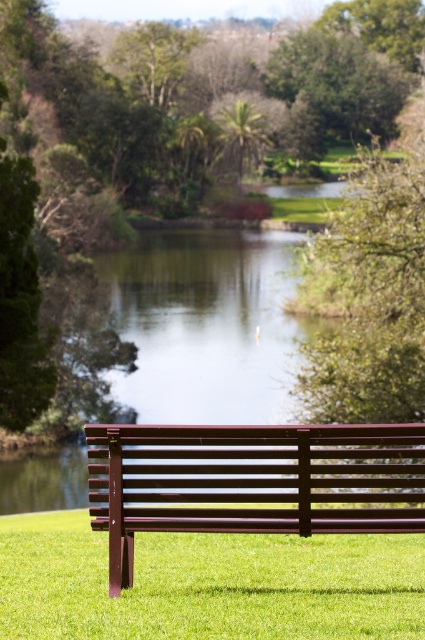
You are a gardener who needs to mow the green grass at center. However, there is a metallic brown bench at lower center in the way. Can you mow the grass without moving the bench?

The green grass at center is positioned under the metallic brown bench at lower center, so you cannot mow the grass without moving the bench because the bench is directly over the grass area.

You are standing in the park and want to sit on the metallic brown bench at lower center. Which direction should you walk from the green grass at center to reach the bench?

You should walk to the right from the green grass at center to reach the metallic brown bench at lower center because the green grass at center is located to the left of the bench.

You are standing in the park and want to determine which of the two points, point [74,532] or point [393,433], is closer to you. Based on the scene, can you tell which one is nearer?

Point [74,532] is closer to you because it is further to the viewer than point [393,433].